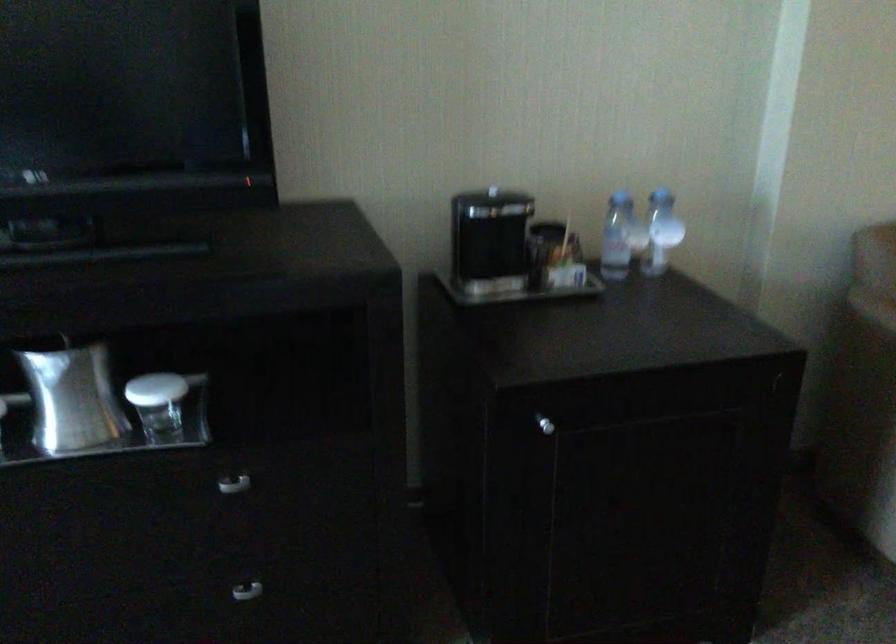
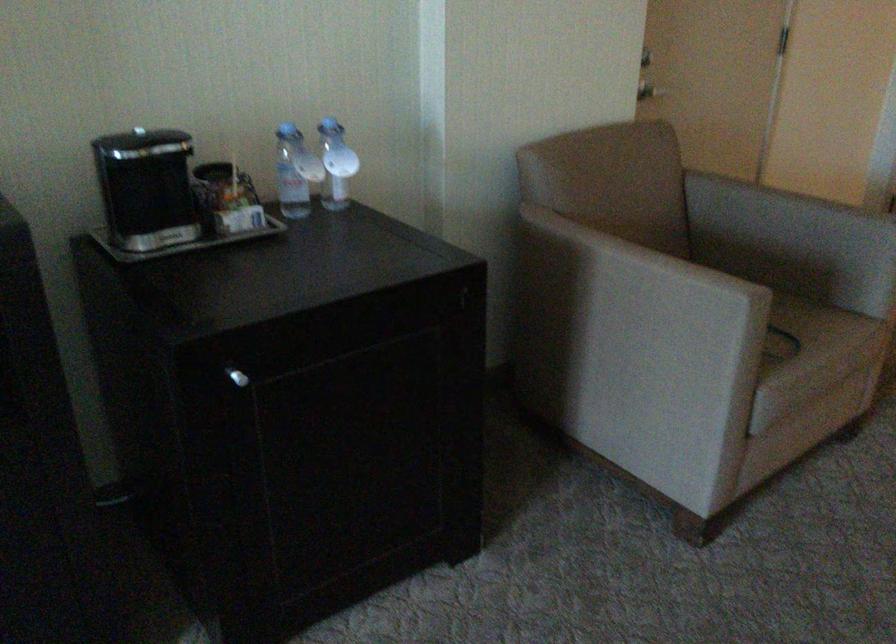
Where in the second image is the point corresponding to (x=547, y=227) from the first image?

(212, 171)